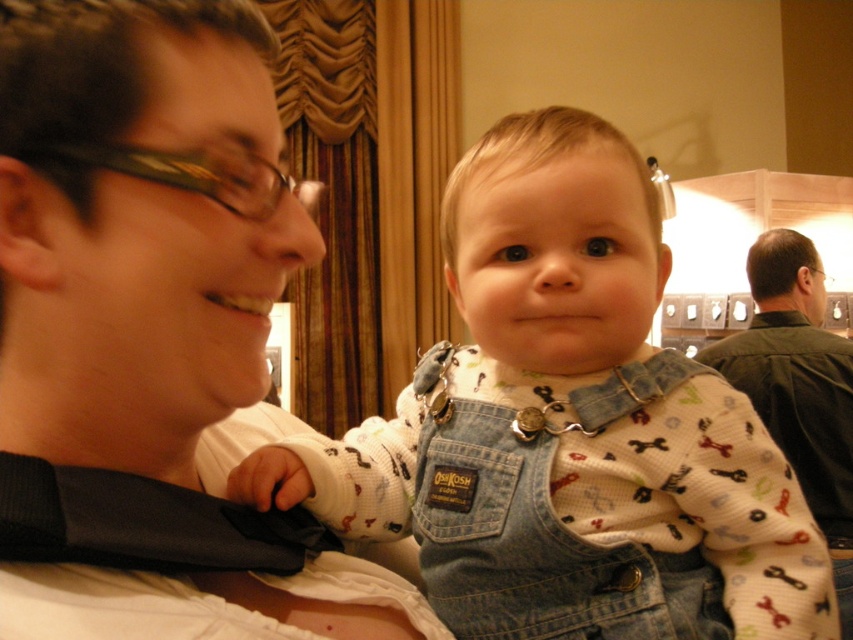
Question: In this image, where is matte black tie at left located relative to green cotton shirt at upper right?

Choices:
 (A) below
 (B) above

Answer: (B)

Question: Which of the following is the farthest from the observer?

Choices:
 (A) denim overalls at center
 (B) matte black tie at left
 (C) green cotton shirt at upper right

Answer: (C)

Question: Which of the following is the farthest from the observer?

Choices:
 (A) (457, 512)
 (B) (257, 332)
 (C) (798, 324)

Answer: (C)

Question: Does denim overalls at center come behind green cotton shirt at upper right?

Choices:
 (A) no
 (B) yes

Answer: (A)

Question: Which of the following is the closest to the observer?

Choices:
 (A) matte black tie at left
 (B) green cotton shirt at upper right
 (C) denim overalls at center

Answer: (A)

Question: Is denim overalls at center positioned at the back of green cotton shirt at upper right?

Choices:
 (A) no
 (B) yes

Answer: (A)